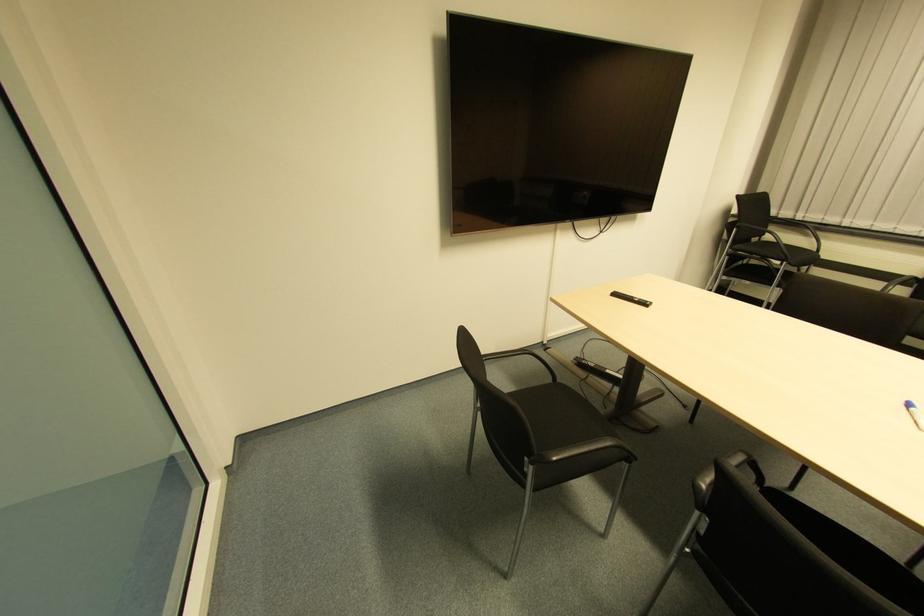
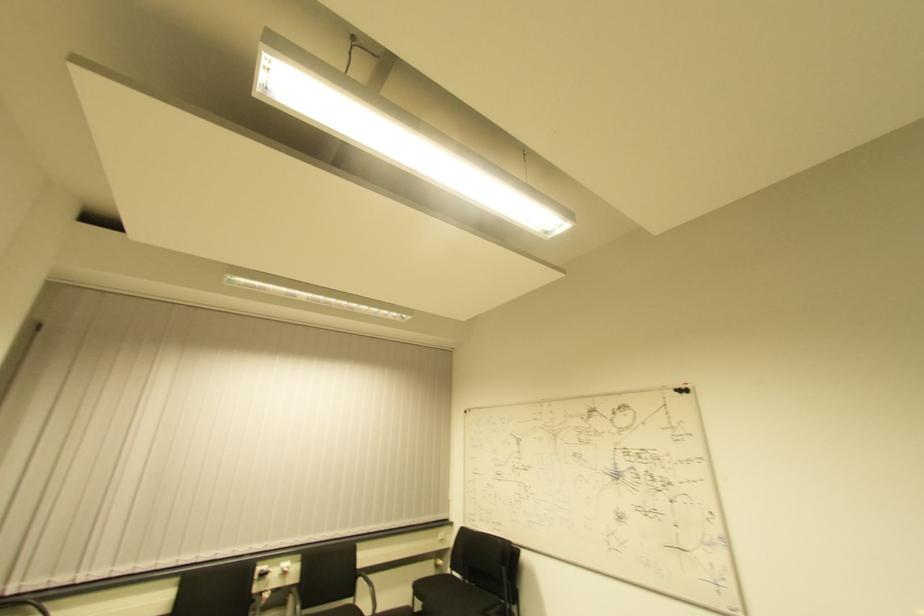
The images are taken continuously from a first-person perspective. In which direction is your viewpoint rotating?

The rotation direction of the camera is right-up.